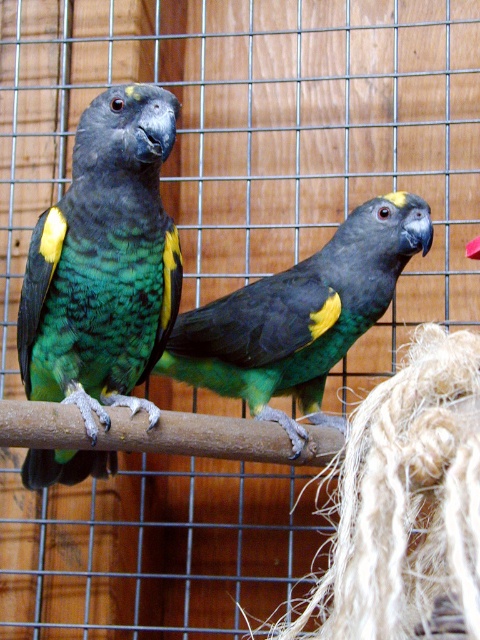
Does green matte parrot at center have a smaller size compared to brown wooden branch at center?

No.

Is the position of green matte parrot at center less distant than that of brown wooden branch at center?

No, green matte parrot at center is behind brown wooden branch at center.

Between point (262, 384) and point (236, 433), which one is positioned in front?

Point (236, 433) is in front.

The width and height of the screenshot is (480, 640). In order to click on green matte parrot at center in this screenshot , I will do `click(300, 316)`.

Can you confirm if green matte parrot at left is positioned to the left of brown wooden branch at center?

Indeed, green matte parrot at left is positioned on the left side of brown wooden branch at center.

Between green matte parrot at left and brown wooden branch at center, which one is positioned higher?

Positioned higher is green matte parrot at left.

Between point (63, 452) and point (220, 448), which one is positioned behind?

Point (63, 452)

Identify the location of green matte parrot at left. (104, 262).

Between green matte parrot at left and green matte parrot at center, which one is positioned higher?

green matte parrot at left

The height and width of the screenshot is (640, 480). Describe the element at coordinates (104, 262) in the screenshot. I see `green matte parrot at left` at that location.

Is point (162, 340) farther from camera compared to point (403, 218)?

No, it is in front of (403, 218).

You are a GUI agent. You are given a task and a screenshot of the screen. Output one action in this format:
    pyautogui.click(x=<x>, y=<y>)
    Task: Click on the green matte parrot at left
    This screenshot has height=640, width=480.
    Given the screenshot: What is the action you would take?
    pyautogui.click(x=104, y=262)